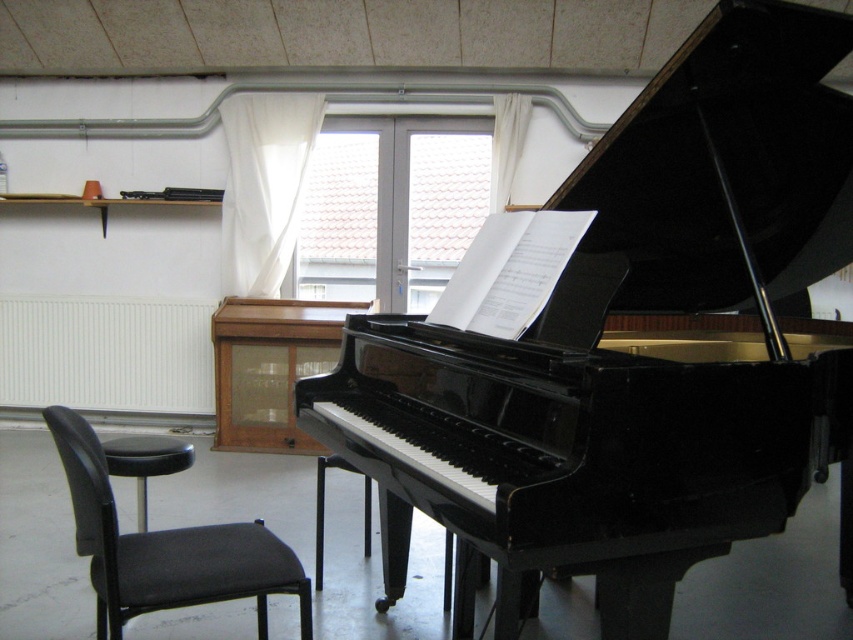
Can you confirm if black fabric chair at lower left is smaller than black leather stool at lower left?

No.

The image size is (853, 640). Describe the element at coordinates (165, 548) in the screenshot. I see `black fabric chair at lower left` at that location.

Which is behind, point (109, 554) or point (141, 486)?

The point (141, 486) is behind.

The width and height of the screenshot is (853, 640). Identify the location of black fabric chair at lower left. click(165, 548).

Does point (427, 486) lie behind point (374, 179)?

No, it is not.

Does glossy black piano at center appear under white plastic window at center?

Indeed, glossy black piano at center is positioned under white plastic window at center.

Identify the location of glossy black piano at center. This screenshot has width=853, height=640. (630, 348).

Does white plastic window at center appear under black leather stool at lower left?

Incorrect, white plastic window at center is not positioned below black leather stool at lower left.

Between point (402, 168) and point (111, 472), which one is positioned behind?

Positioned behind is point (402, 168).

The image size is (853, 640). What do you see at coordinates (392, 205) in the screenshot?
I see `white plastic window at center` at bounding box center [392, 205].

At what (x,y) coordinates should I click in order to perform the action: click on white plastic window at center. Please return your answer as a coordinate pair (x, y). This screenshot has height=640, width=853. Looking at the image, I should click on (392, 205).